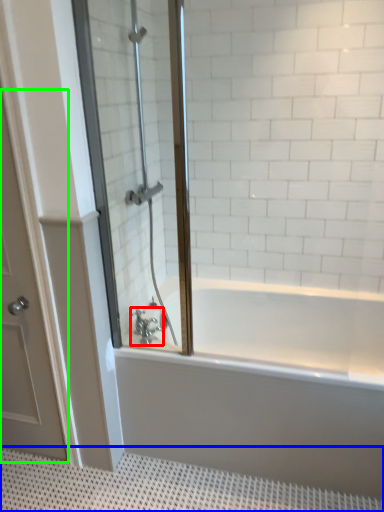
Question: Estimate the real-world distances between objects in this image. Which object is farther from tap (highlighted by a red box), bath mat (highlighted by a blue box) or door (highlighted by a green box)?

Choices:
 (A) bath mat
 (B) door

Answer: (A)